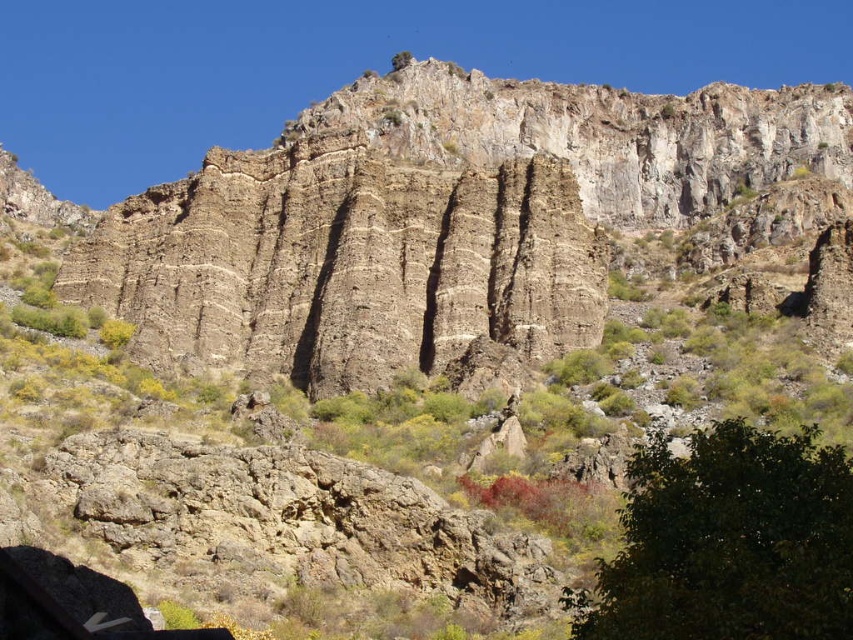
You are a hiker trying to navigate through the rocky landscape. You see the brown rough rock face at center and the green leafy tree at lower right. Which object is positioned higher in elevation?

The brown rough rock face at center is above the green leafy tree at lower right, so it is positioned higher in elevation.

You are a hiker planning to walk from the brown rough rock face at center to the green leafy tree at lower right. Which direction should you move to get closer to the tree?

To get closer to the green leafy tree at lower right, you should move away from the brown rough rock face at center since it is closer to you than the tree.